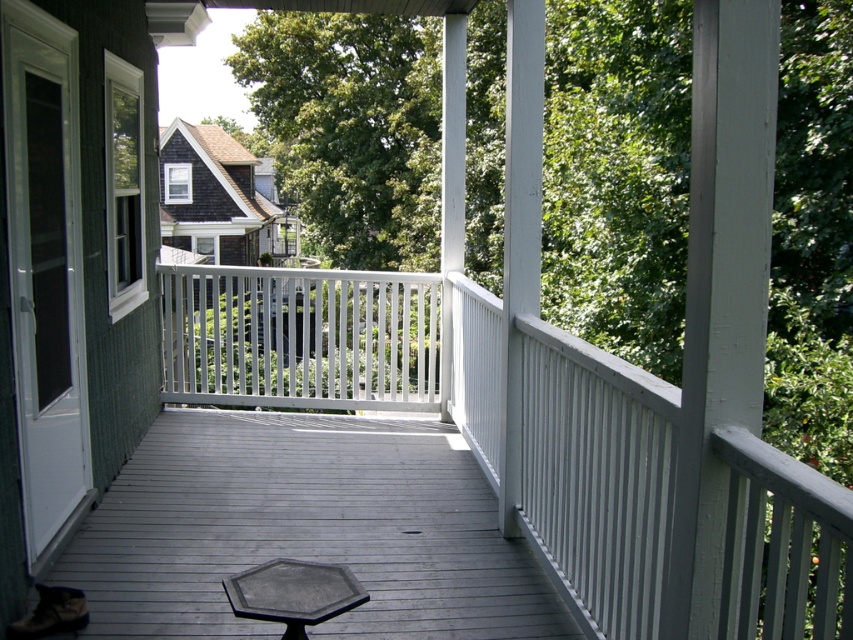
Can you confirm if white painted wood balustrade at center is smaller than white plastic chair at center?

Yes.

Is point (335, 296) more distant than point (286, 296)?

Yes, point (335, 296) is farther from viewer.

You are a GUI agent. You are given a task and a screenshot of the screen. Output one action in this format:
    pyautogui.click(x=<x>, y=<y>)
    Task: Click on the white painted wood balustrade at center
    The image size is (853, 640).
    Given the screenshot: What is the action you would take?
    pyautogui.click(x=299, y=337)

Identify the location of white painted wood balustrade at center. (299, 337).

Is gray wood deck at center closer to camera compared to white painted wood balustrade at center?

Yes.

Is gray wood deck at center smaller than white painted wood balustrade at center?

Yes.

Does point (234, 556) come behind point (415, 339)?

That is False.

Find the location of a particular element. gray wood deck at center is located at coordinates (305, 531).

Does point (97, 528) lie in front of point (300, 333)?

Yes, point (97, 528) is closer to viewer.

Find the location of a particular element. The height and width of the screenshot is (640, 853). gray wood deck at center is located at coordinates (305, 531).